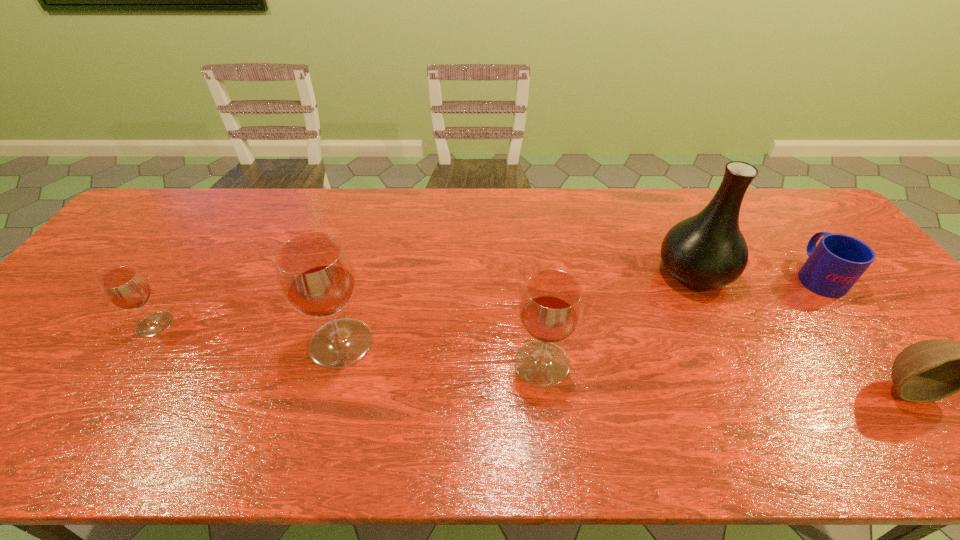
With all wineglasss evenly spaced, where should an extra wineglass be placed on the right to continue the pattern? Please point out a vacant space. Please provide its 2D coordinates. Your answer should be formatted as a tuple, i.e. [(x, y)], where the tuple contains the x and y coordinates of a point satisfying the conditions above.

[(758, 385)]